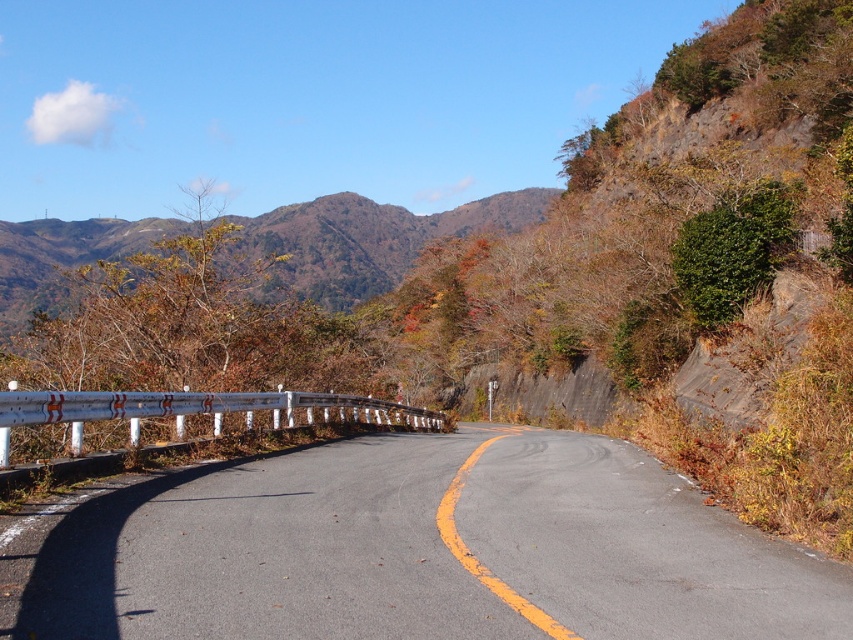
You are a hiker standing at the point marked by the coordinates point (x=426, y=550). Looking at the scene, which direction should you walk to reach the white guardrail with red stripes on the left side of the road?

The white guardrail with red stripes is on the left side of the road. Since you are at the point marked by point (x=426, y=550), which is on the asphalt road at center, you should walk to the left to reach the white guardrail with red stripes.

You are a hiker planning to take a photo of the scenic road from a viewpoint. You spot two points marked on your map as point coordinates. Which point, point (732, 636) or point (33, 276), is closer to your current position?

Point (732, 636) is closer to the camera than point (33, 276), so it is closer to your current position.

You are driving a car and see the asphalt road at center and the brown textured mountain at upper center. Which object is higher in the image?

The brown textured mountain at upper center is higher in the image than the asphalt road at center.